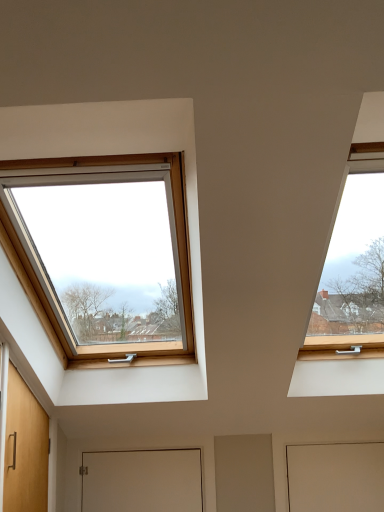
Question: Is white matte door at center, the 2th door when ordered from right to left, taller or shorter than white matte door at lower right, the 2th door from the left?

Choices:
 (A) tall
 (B) short

Answer: (B)

Question: From the image's perspective, is white matte door at center, the 1th door in the left-to-right sequence, above or below white matte door at lower right, the 2th door from the left?

Choices:
 (A) above
 (B) below

Answer: (B)

Question: From a real-world perspective, is white matte door at center, the 2th door when ordered from right to left, positioned above or below white matte door at lower right, the 2th door from the left?

Choices:
 (A) above
 (B) below

Answer: (A)

Question: From their relative heights in the image, would you say white matte door at lower right, the first door in the right-to-left sequence, is taller or shorter than white matte door at center, the 1th door in the left-to-right sequence?

Choices:
 (A) tall
 (B) short

Answer: (A)

Question: Is white matte door at lower right, the 2th door from the left, inside the boundaries of white matte door at center, the 2th door when ordered from right to left, or outside?

Choices:
 (A) inside
 (B) outside

Answer: (B)

Question: Does point (370, 494) appear closer or farther from the camera than point (112, 479)?

Choices:
 (A) farther
 (B) closer

Answer: (B)

Question: Is white matte door at lower right, the first door in the right-to-left sequence, wider or thinner than white matte door at center, the 1th door in the left-to-right sequence?

Choices:
 (A) thin
 (B) wide

Answer: (B)